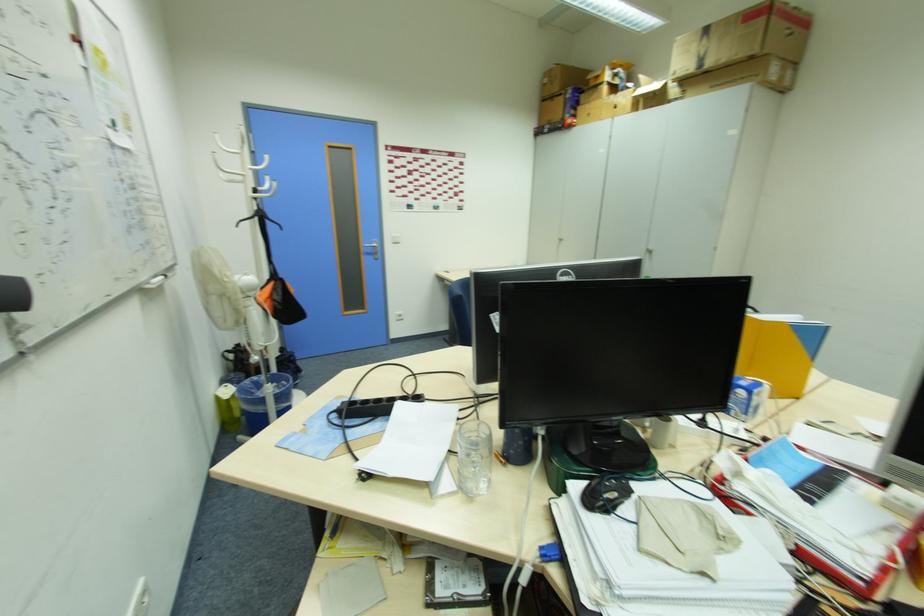
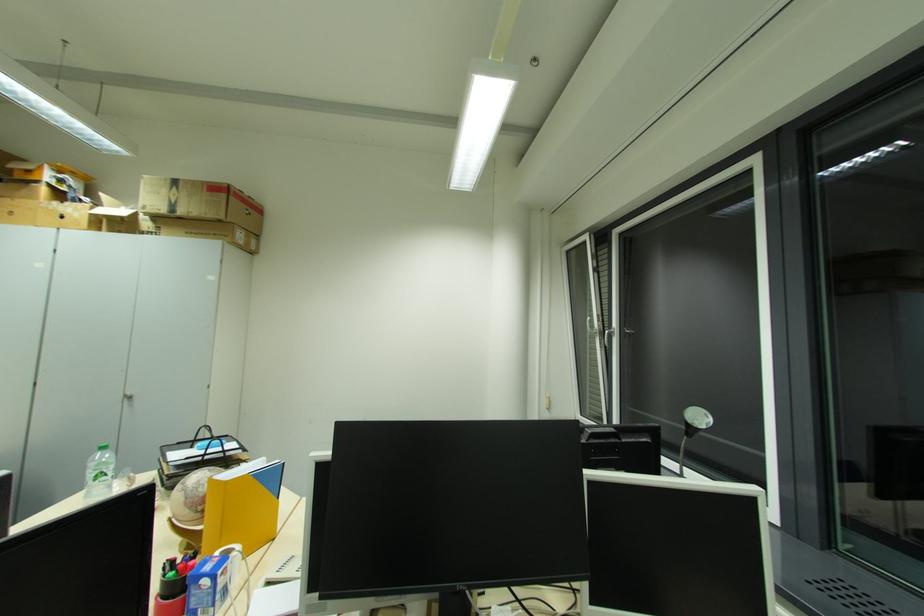
The point at (685, 71) is marked in the first image. Where is the corresponding point in the second image?

(152, 209)